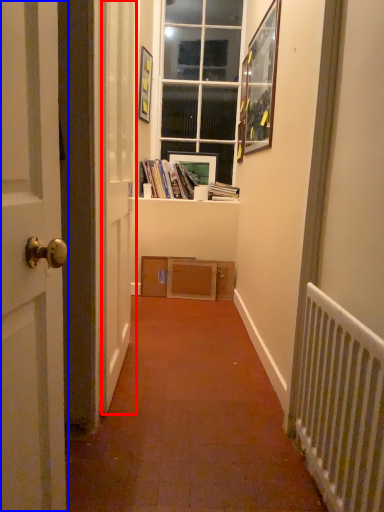
Question: Among these objects, which one is nearest to the camera, screen door (highlighted by a red box) or door (highlighted by a blue box)?

Choices:
 (A) screen door
 (B) door

Answer: (B)